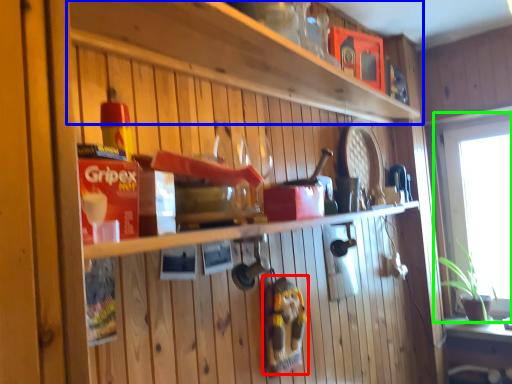
Question: Which object is the closest to the toy (highlighted by a red box)? Choose among these: shelf (highlighted by a blue box) or window (highlighted by a green box).

Choices:
 (A) shelf
 (B) window

Answer: (A)